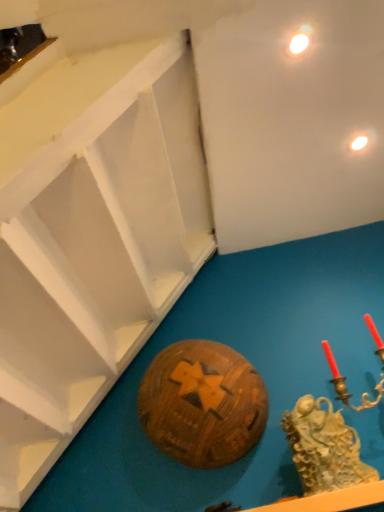
Question: From the image's perspective, is gold textured sculpture at lower right under matte white light at upper right, the second light when ordered from top to bottom?

Choices:
 (A) yes
 (B) no

Answer: (A)

Question: Is matte white light at upper right, which is counted as the first light, starting from the bottom, surrounded by gold textured sculpture at lower right?

Choices:
 (A) yes
 (B) no

Answer: (B)

Question: From a real-world perspective, does gold textured sculpture at lower right stand above matte white light at upper right, acting as the 1th light starting from the back?

Choices:
 (A) no
 (B) yes

Answer: (A)

Question: Does gold textured sculpture at lower right have a smaller size compared to matte white light at upper right, acting as the 1th light starting from the back?

Choices:
 (A) no
 (B) yes

Answer: (A)

Question: Is gold textured sculpture at lower right facing towards matte white light at upper right, acting as the 1th light starting from the back?

Choices:
 (A) no
 (B) yes

Answer: (A)

Question: Based on their positions, is matte white light at upper right, positioned as the second light in right-to-left order, located to the left or right of matte white light at upper right, which is counted as the first light, starting from the bottom?

Choices:
 (A) left
 (B) right

Answer: (A)

Question: From a real-world perspective, is matte white light at upper right, marked as the second light in a bottom-to-top arrangement, physically located above or below matte white light at upper right, arranged as the 1th light when viewed from the right?

Choices:
 (A) below
 (B) above

Answer: (A)

Question: In terms of height, does matte white light at upper right, which is counted as the first light, starting from the left, look taller or shorter compared to matte white light at upper right, the second light when ordered from top to bottom?

Choices:
 (A) short
 (B) tall

Answer: (A)

Question: Is matte white light at upper right, the 1th light when ordered from top to bottom, in front of or behind matte white light at upper right, which is counted as the first light, starting from the bottom, in the image?

Choices:
 (A) behind
 (B) front

Answer: (B)

Question: From the image's perspective, is wooden ball at center above or below matte white light at upper right, the second light when ordered from back to front?

Choices:
 (A) below
 (B) above

Answer: (A)

Question: Relative to matte white light at upper right, the 1th light when ordered from top to bottom, is wooden ball at center in front or behind?

Choices:
 (A) behind
 (B) front

Answer: (A)

Question: In terms of height, does wooden ball at center look taller or shorter compared to matte white light at upper right, which is the 1th light from front to back?

Choices:
 (A) short
 (B) tall

Answer: (B)

Question: Would you say wooden ball at center is inside or outside matte white light at upper right, positioned as the second light in right-to-left order?

Choices:
 (A) inside
 (B) outside

Answer: (B)

Question: Is wooden ball at center spatially inside gold textured sculpture at lower right, or outside of it?

Choices:
 (A) outside
 (B) inside

Answer: (A)

Question: From a real-world perspective, is wooden ball at center above or below gold textured sculpture at lower right?

Choices:
 (A) below
 (B) above

Answer: (B)